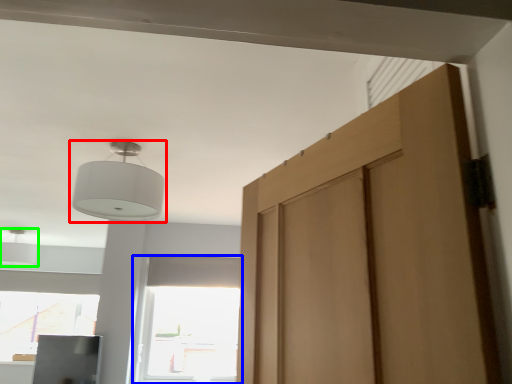
Question: Which object is the farthest from lamp (highlighted by a red box)? Choose among these: window (highlighted by a blue box) or light (highlighted by a green box).

Choices:
 (A) window
 (B) light

Answer: (B)